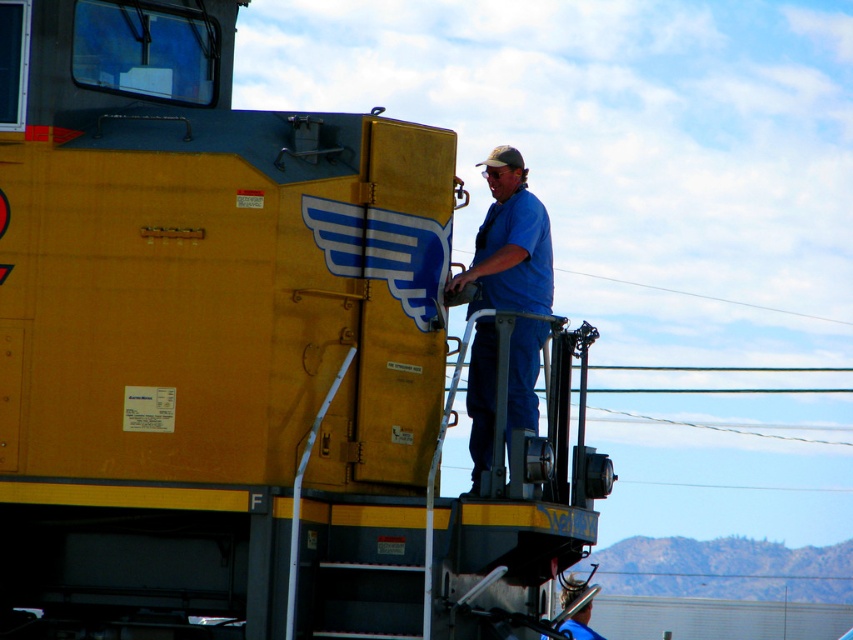
Who is taller, yellow matte train at center or blue cotton shirt at center?

With more height is yellow matte train at center.

Between yellow matte train at center and blue cotton shirt at center, which one appears on the left side from the viewer's perspective?

From the viewer's perspective, yellow matte train at center appears more on the left side.

Does point (167, 355) lie behind point (531, 336)?

No.

This screenshot has height=640, width=853. I want to click on yellow matte train at center, so click(236, 356).